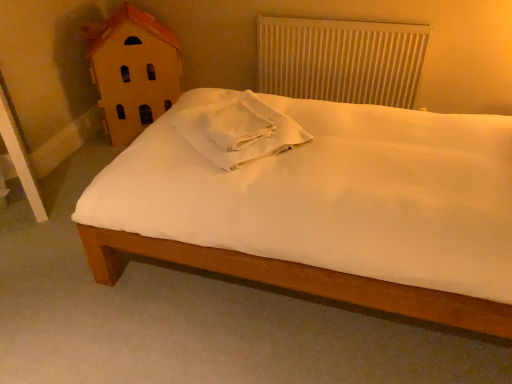
Question: Could you tell me if wooden house at left is turned towards white matte bed at center?

Choices:
 (A) yes
 (B) no

Answer: (A)

Question: Does wooden house at left appear on the left side of white matte bed at center?

Choices:
 (A) yes
 (B) no

Answer: (A)

Question: Does wooden house at left lie in front of white matte bed at center?

Choices:
 (A) yes
 (B) no

Answer: (B)

Question: From a real-world perspective, is wooden house at left beneath white matte bed at center?

Choices:
 (A) no
 (B) yes

Answer: (A)

Question: Is wooden house at left smaller than white matte bed at center?

Choices:
 (A) yes
 (B) no

Answer: (A)

Question: Is the surface of wooden house at left in direct contact with white matte bed at center?

Choices:
 (A) no
 (B) yes

Answer: (A)

Question: Is white textured radiator at upper center not within white cotton towel at center?

Choices:
 (A) no
 (B) yes

Answer: (B)

Question: Can you confirm if white textured radiator at upper center is thinner than white cotton towel at center?

Choices:
 (A) yes
 (B) no

Answer: (A)

Question: Is white cotton towel at center a part of white textured radiator at upper center?

Choices:
 (A) no
 (B) yes

Answer: (A)

Question: From a real-world perspective, is white textured radiator at upper center located higher than white cotton towel at center?

Choices:
 (A) yes
 (B) no

Answer: (B)

Question: Is white textured radiator at upper center facing towards white cotton towel at center?

Choices:
 (A) no
 (B) yes

Answer: (B)

Question: Considering the relative positions of white textured radiator at upper center and white cotton towel at center in the image provided, is white textured radiator at upper center to the right of white cotton towel at center from the viewer's perspective?

Choices:
 (A) no
 (B) yes

Answer: (B)

Question: Does white matte bed at center have a lesser width compared to white textured radiator at upper center?

Choices:
 (A) yes
 (B) no

Answer: (B)